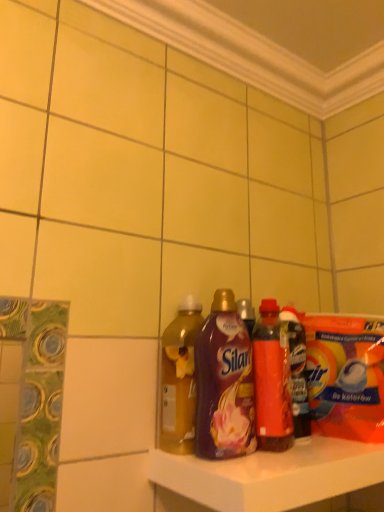
Locate an element on the screen. Image resolution: width=384 pixels, height=512 pixels. free space to the right of purple plastic bottle at center, the second bottle in the left-to-right sequence is located at coordinates (304, 454).